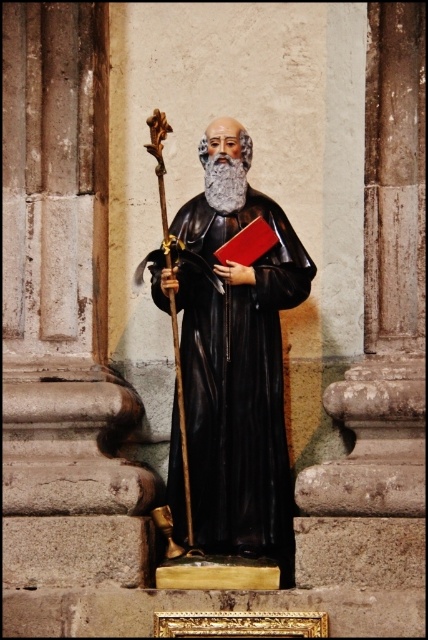
Question: Where is black glossy statue at center located in relation to graywoollybeard at center in the image?

Choices:
 (A) below
 (B) above

Answer: (A)

Question: Which object appears farthest from the camera in this image?

Choices:
 (A) graywoollybeard at center
 (B) black glossy statue at center

Answer: (A)

Question: Does black glossy statue at center appear on the left side of graywoollybeard at center?

Choices:
 (A) yes
 (B) no

Answer: (A)

Question: Considering the relative positions of black glossy statue at center and graywoollybeard at center in the image provided, where is black glossy statue at center located with respect to graywoollybeard at center?

Choices:
 (A) right
 (B) left

Answer: (B)

Question: Which object is farther from the camera taking this photo?

Choices:
 (A) graywoollybeard at center
 (B) black glossy statue at center

Answer: (A)

Question: Which of the following is the farthest from the observer?

Choices:
 (A) (187, 236)
 (B) (240, 170)

Answer: (A)